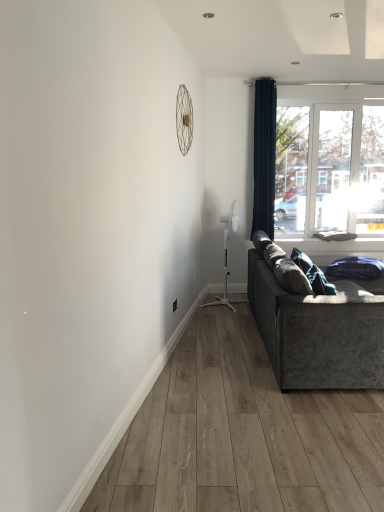
Question: Does transparent glass window at upper right have a smaller size compared to white plastic mechanical fan at center-right, placed as the 1th mechanical fan when sorted from right to left?

Choices:
 (A) yes
 (B) no

Answer: (A)

Question: Is transparent glass window at upper right outside white plastic mechanical fan at center-right, arranged as the 2th mechanical fan when viewed from the front?

Choices:
 (A) no
 (B) yes

Answer: (B)

Question: Is transparent glass window at upper right shorter than white plastic mechanical fan at center-right, the second mechanical fan positioned from the left?

Choices:
 (A) yes
 (B) no

Answer: (B)

Question: Is transparent glass window at upper right looking in the opposite direction of white plastic mechanical fan at center-right, the second mechanical fan positioned from the left?

Choices:
 (A) no
 (B) yes

Answer: (A)

Question: Is the surface of transparent glass window at upper right in direct contact with white plastic mechanical fan at center-right, placed as the 1th mechanical fan when sorted from right to left?

Choices:
 (A) no
 (B) yes

Answer: (A)

Question: From the image's perspective, is metallic wire at upper center, the first mechanical fan in the top-to-bottom sequence, above or below transparent glass window at upper right?

Choices:
 (A) above
 (B) below

Answer: (A)

Question: In terms of height, does metallic wire at upper center, the first mechanical fan in the top-to-bottom sequence, look taller or shorter compared to transparent glass window at upper right?

Choices:
 (A) tall
 (B) short

Answer: (B)

Question: Considering the positions of metallic wire at upper center, the first mechanical fan in the top-to-bottom sequence, and transparent glass window at upper right in the image, is metallic wire at upper center, the first mechanical fan in the top-to-bottom sequence, bigger or smaller than transparent glass window at upper right?

Choices:
 (A) big
 (B) small

Answer: (B)

Question: Is point (190, 134) closer or farther from the camera than point (364, 159)?

Choices:
 (A) farther
 (B) closer

Answer: (B)

Question: Looking at the image, does velvet blue pillow at lower right seem bigger or smaller compared to transparent glass window at upper right?

Choices:
 (A) big
 (B) small

Answer: (B)

Question: Is velvet blue pillow at lower right spatially inside transparent glass window at upper right, or outside of it?

Choices:
 (A) inside
 (B) outside

Answer: (B)

Question: Is velvet blue pillow at lower right in front of or behind transparent glass window at upper right in the image?

Choices:
 (A) front
 (B) behind

Answer: (A)

Question: In terms of width, does velvet blue pillow at lower right look wider or thinner when compared to transparent glass window at upper right?

Choices:
 (A) thin
 (B) wide

Answer: (B)

Question: From the image's perspective, is white plastic mechanical fan at center-right, which is counted as the 2th mechanical fan, starting from the top, above or below velvet blue pillow at lower right?

Choices:
 (A) below
 (B) above

Answer: (B)

Question: Would you say white plastic mechanical fan at center-right, positioned as the 1th mechanical fan in bottom-to-top order, is inside or outside velvet blue pillow at lower right?

Choices:
 (A) outside
 (B) inside

Answer: (A)